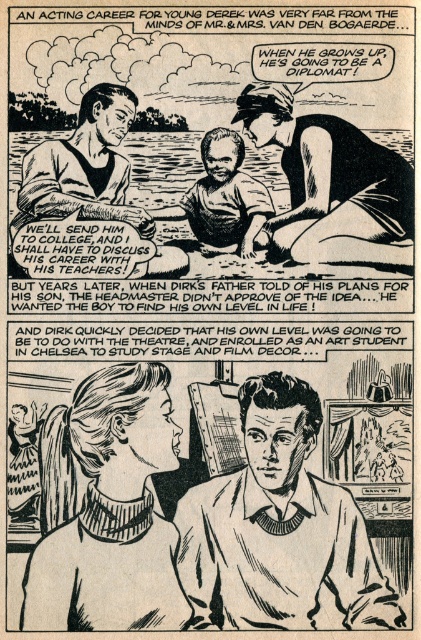
Can you confirm if smooth sweater at center is bigger than smooth brown shirt at center?

No.

Who is more forward, (341, 540) or (210, 204)?

Positioned in front is point (341, 540).

Locate an element on the screen. This screenshot has height=640, width=421. smooth sweater at center is located at coordinates (279, 529).

Who is positioned more to the right, smooth skin man at center or smooth navy sailor suit at upper center?

From the viewer's perspective, smooth skin man at center appears more on the right side.

Which of these two, smooth skin man at center or smooth navy sailor suit at upper center, stands taller?

smooth navy sailor suit at upper center is taller.

Is point (402, 177) farther from viewer compared to point (98, 180)?

Yes, it is behind point (98, 180).

In order to click on smooth skin man at center in this screenshot , I will do `click(333, 184)`.

Who is lower down, smooth sweater at center or smooth skin man at center?

smooth sweater at center is lower down.

Does smooth sweater at center lie behind smooth skin man at center?

No, smooth sweater at center is in front of smooth skin man at center.

Is point (373, 557) positioned before point (394, 225)?

That is True.

This screenshot has width=421, height=640. What are the coordinates of `smooth sweater at center` in the screenshot? It's located at (279, 529).